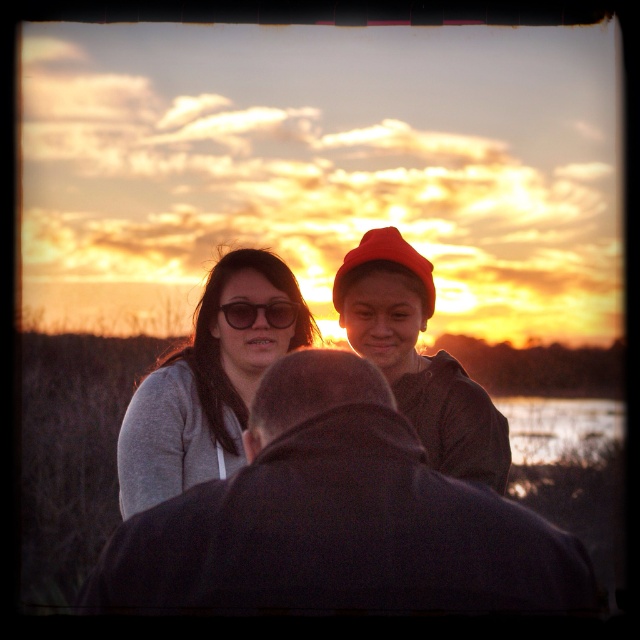
You are taking a photo of the matte red beanie at center and the matte black sunglasses at center. Which object should you focus on first to ensure both are in sharp focus?

You should focus on the matte red beanie at center first since it is closer to the camera than the matte black sunglasses at center, ensuring both will be in focus when using depth of field properly.

You are taking a photo of the matte red beanie at center and the matte black sunglasses at center. Which object should you focus on first if you want to capture both in sharp focus?

The matte black sunglasses at center should be focused on first because it is closer to the camera than the matte red beanie at center, ensuring both will be in focus when using depth of field properly.

You are standing in the sunset scene and want to take a photo of the matte gray sweater at center. Where should you aim your camera to capture it?

You should aim your camera at point (202,394) to capture the matte gray sweater at center.